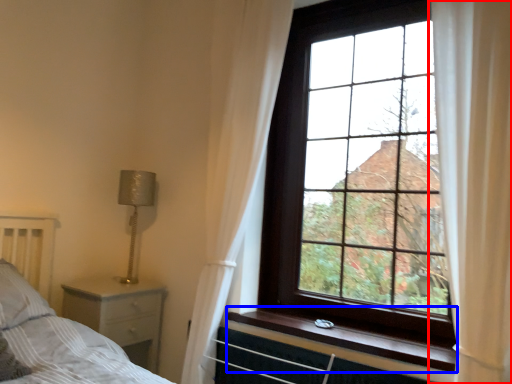
Question: Which point is closer to the camera, curtain (highlighted by a red box) or window sill (highlighted by a blue box)?

Choices:
 (A) curtain
 (B) window sill

Answer: (A)